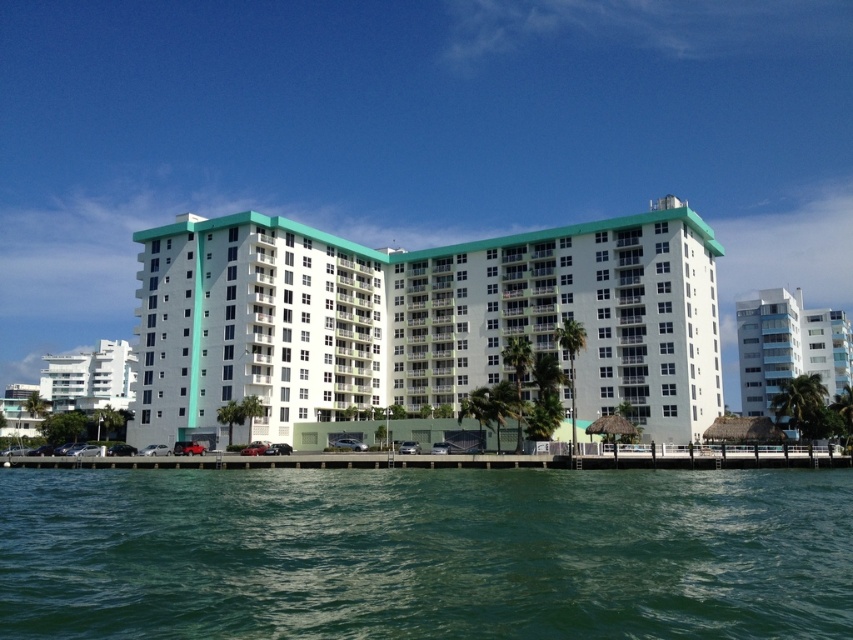
Question: Is white glossy building at center to the left of smooth concrete dock at lower center from the viewer's perspective?

Choices:
 (A) yes
 (B) no

Answer: (B)

Question: Which point is closer to the camera taking this photo?

Choices:
 (A) (733, 536)
 (B) (585, 456)
 (C) (808, 323)
 (D) (42, 392)

Answer: (A)

Question: Does green water at lower center have a lesser width compared to white glossy building at center?

Choices:
 (A) yes
 (B) no

Answer: (A)

Question: Can you confirm if green water at lower center is thinner than white glossy building at left?

Choices:
 (A) yes
 (B) no

Answer: (A)

Question: Which of these objects is positioned farthest from the white glass building at right?

Choices:
 (A) white glossy building at center
 (B) white glossy building at left

Answer: (B)

Question: Which object is positioned farthest from the white glossy building at left?

Choices:
 (A) smooth concrete dock at lower center
 (B) green water at lower center
 (C) white glass building at right
 (D) white glossy building at center

Answer: (C)